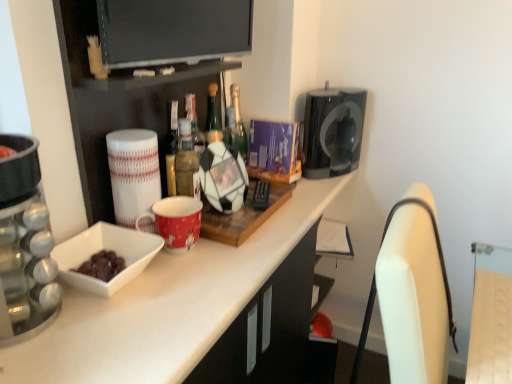
Question: Considering the relative sizes of flat screen tv at upper center and light brown wood swivel chair at right, marked as the 1th swivel chair in a top-to-bottom arrangement, in the image provided, is flat screen tv at upper center bigger than light brown wood swivel chair at right, marked as the 1th swivel chair in a top-to-bottom arrangement,?

Choices:
 (A) no
 (B) yes

Answer: (A)

Question: Could you tell me if flat screen tv at upper center is turned towards light brown wood swivel chair at right, arranged as the second swivel chair when ordered from the bottom?

Choices:
 (A) no
 (B) yes

Answer: (A)

Question: Is flat screen tv at upper center wider than light brown wood swivel chair at right, marked as the 1th swivel chair in a top-to-bottom arrangement?

Choices:
 (A) yes
 (B) no

Answer: (B)

Question: From the image's perspective, does flat screen tv at upper center appear lower than light brown wood swivel chair at right, marked as the 1th swivel chair in a top-to-bottom arrangement?

Choices:
 (A) yes
 (B) no

Answer: (B)

Question: Is flat screen tv at upper center taller than light brown wood swivel chair at right, arranged as the second swivel chair when ordered from the bottom?

Choices:
 (A) no
 (B) yes

Answer: (B)

Question: Is point [x=168, y=311] closer or farther from the camera than point [x=206, y=51]?

Choices:
 (A) farther
 (B) closer

Answer: (B)

Question: Is white glossy countertop at center to the left or to the right of flat screen tv at upper center in the image?

Choices:
 (A) left
 (B) right

Answer: (B)

Question: Considering the positions of white glossy countertop at center and flat screen tv at upper center in the image, is white glossy countertop at center wider or thinner than flat screen tv at upper center?

Choices:
 (A) wide
 (B) thin

Answer: (A)

Question: From the image's perspective, is white glossy countertop at center above or below flat screen tv at upper center?

Choices:
 (A) below
 (B) above

Answer: (A)

Question: From a real-world perspective, is white ceramic mug at left, the 1th appliance in the front-to-back sequence, positioned above or below light brown wood swivel chair at right, marked as the 1th swivel chair in a top-to-bottom arrangement?

Choices:
 (A) above
 (B) below

Answer: (A)

Question: From the image's perspective, is white ceramic mug at left, marked as the 2th appliance in a back-to-front arrangement, above or below light brown wood swivel chair at right, marked as the 1th swivel chair in a top-to-bottom arrangement?

Choices:
 (A) above
 (B) below

Answer: (A)

Question: Is white ceramic mug at left, the second appliance when ordered from right to left, wider or thinner than light brown wood swivel chair at right, arranged as the second swivel chair when ordered from the bottom?

Choices:
 (A) wide
 (B) thin

Answer: (B)

Question: In terms of height, does white ceramic mug at left, marked as the 2th appliance in a back-to-front arrangement, look taller or shorter compared to light brown wood swivel chair at right, arranged as the second swivel chair when ordered from the bottom?

Choices:
 (A) tall
 (B) short

Answer: (A)

Question: Considering the positions of point (354, 122) and point (125, 129), is point (354, 122) closer or farther from the camera than point (125, 129)?

Choices:
 (A) closer
 (B) farther

Answer: (B)

Question: From the image's perspective, relative to white ceramic mug at left, the 1th appliance in the front-to-back sequence, is black glossy coffee machine at upper right, arranged as the second appliance when viewed from the front, above or below?

Choices:
 (A) above
 (B) below

Answer: (A)